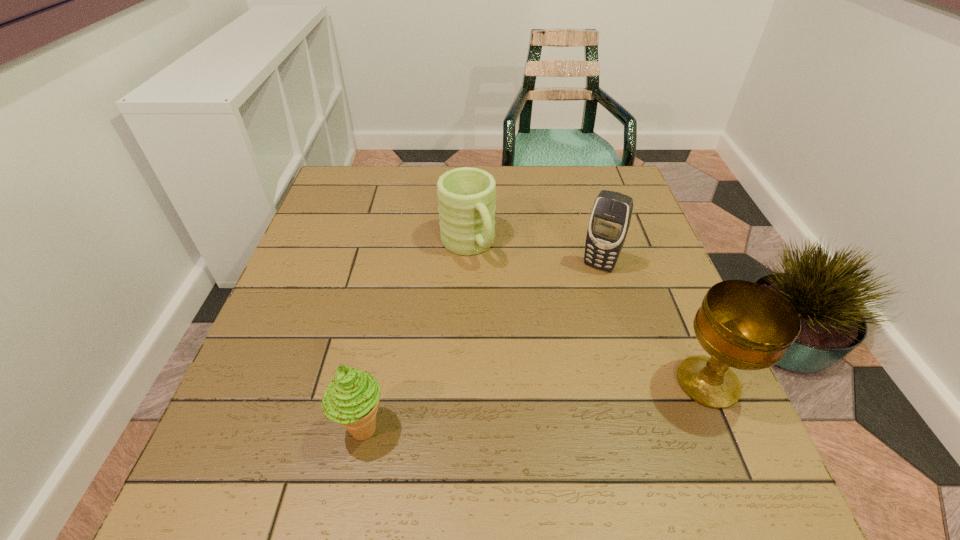
The height and width of the screenshot is (540, 960). Identify the location of vacant space located on the side of the mug with the handle. (497, 296).

You are a GUI agent. You are given a task and a screenshot of the screen. Output one action in this format:
    pyautogui.click(x=<x>, y=<y>)
    Task: Click on the blank space located on the side of the mug with the handle
    
    Given the screenshot: What is the action you would take?
    pyautogui.click(x=545, y=366)

Locate an element on the screen. The width and height of the screenshot is (960, 540). icecream that is at the near edge is located at coordinates pos(351,399).

At what (x,y) coordinates should I click in order to perform the action: click on chalice present at the near edge. Please return your answer as a coordinate pair (x, y). This screenshot has height=540, width=960. Looking at the image, I should click on (741, 324).

You are a GUI agent. You are given a task and a screenshot of the screen. Output one action in this format:
    pyautogui.click(x=<x>, y=<y>)
    Task: Click on the chalice located in the right edge section of the desktop
    This screenshot has width=960, height=540.
    Given the screenshot: What is the action you would take?
    pyautogui.click(x=741, y=324)

Find the location of `cellular telephone located at the right edge`. cellular telephone located at the right edge is located at coordinates (609, 222).

Identify the location of object positioned at the near right corner. Image resolution: width=960 pixels, height=540 pixels. (741, 324).

Locate an element on the screen. The width and height of the screenshot is (960, 540). vacant space at the far edge is located at coordinates (519, 208).

Locate an element on the screen. The width and height of the screenshot is (960, 540). vacant space at the near edge of the desktop is located at coordinates (491, 423).

Find the location of a particular element. Image resolution: width=960 pixels, height=540 pixels. free space at the right edge is located at coordinates (619, 289).